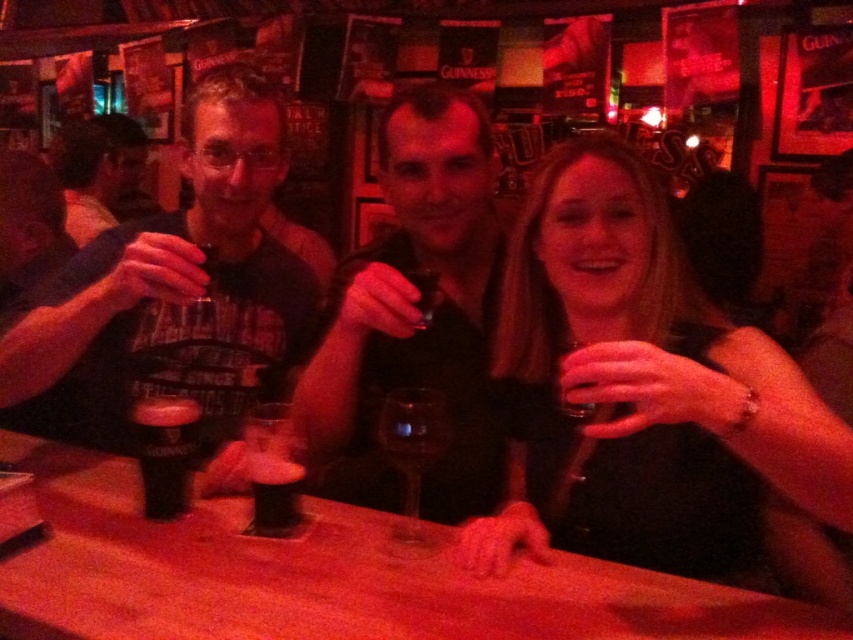
Is point (194, 410) positioned after point (267, 512)?

Yes.

Which of these two, guinness stout glass at center or transparent glass wine at center, stands shorter?

With less height is transparent glass wine at center.

Image resolution: width=853 pixels, height=640 pixels. Identify the location of guinness stout glass at center. (165, 452).

Measure the distance between point (729, 593) and camera.

A distance of 35.50 inches exists between point (729, 593) and camera.

Can you confirm if wooden bar at center is shorter than dark brown glass at center?

No, wooden bar at center is not shorter than dark brown glass at center.

Locate an element on the screen. The image size is (853, 640). wooden bar at center is located at coordinates (328, 577).

Does smooth black wine glass at center lie behind matte black shirt at center?

No, smooth black wine glass at center is closer to the viewer.

Does smooth black wine glass at center appear on the right side of matte black shirt at center?

Correct, you'll find smooth black wine glass at center to the right of matte black shirt at center.

What do you see at coordinates (640, 388) in the screenshot? I see `smooth black wine glass at center` at bounding box center [640, 388].

This screenshot has width=853, height=640. What are the coordinates of `smooth black wine glass at center` in the screenshot? It's located at (640, 388).